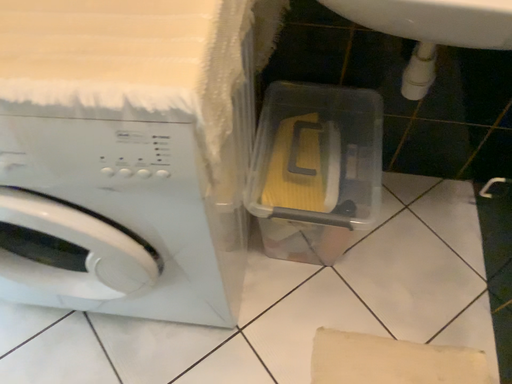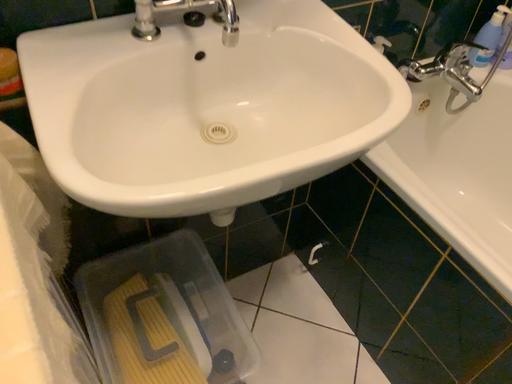
Question: How did the camera likely rotate when shooting the video?

Choices:
 (A) rotated downward
 (B) rotated upward

Answer: (B)